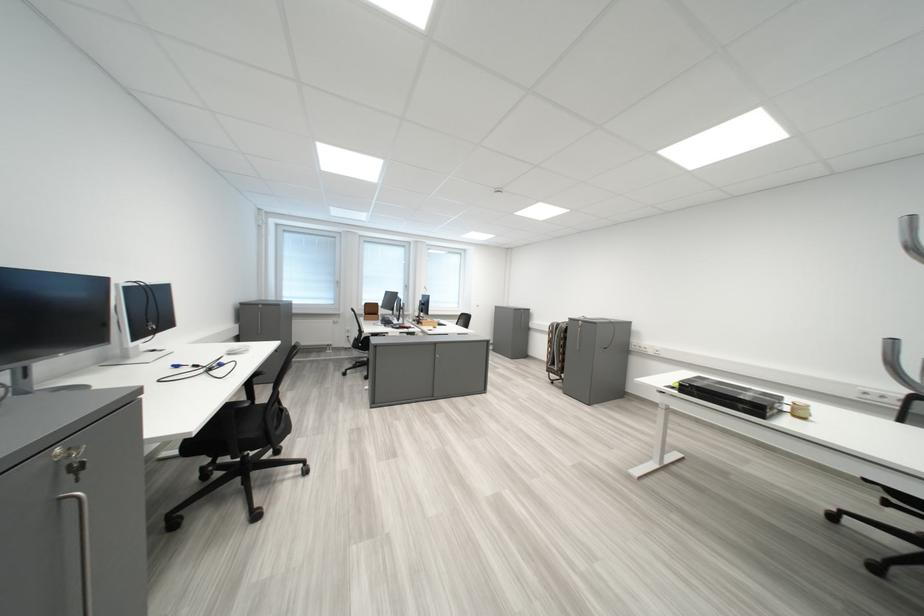
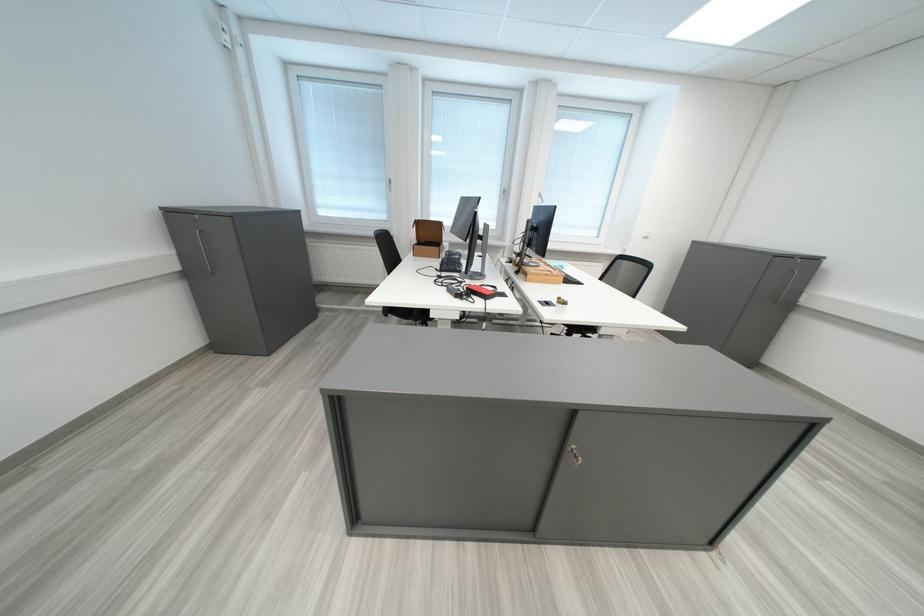
Question: I am providing you with two images of the same scene from different viewpoints. After the viewpoint changes to image2, which objects are now occluded?

Choices:
 (A) red power adapter
 (B) computer mouse
 (C) cabinet handle
 (D) none of these

Answer: (D)